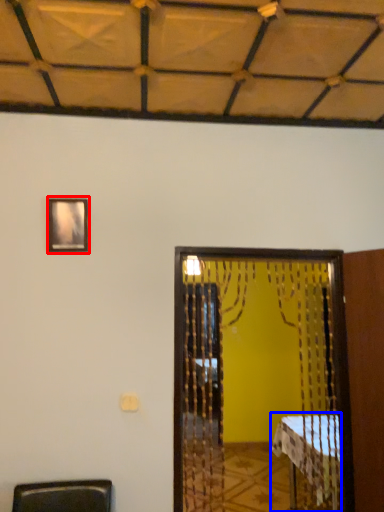
Question: Which object appears farthest to the camera in this image, picture frame (highlighted by a red box) or table (highlighted by a blue box)?

Choices:
 (A) picture frame
 (B) table

Answer: (B)